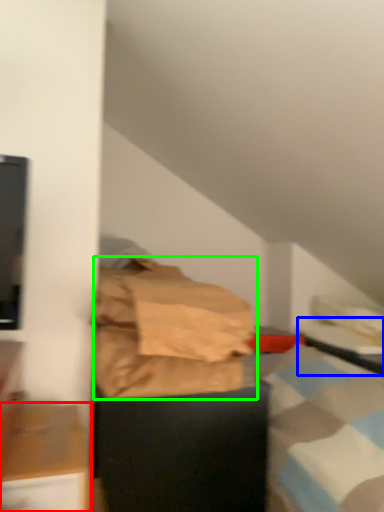
Question: Which object is positioned closest to furniture (highlighted by a red box)? Select from table (highlighted by a blue box) and material (highlighted by a green box).

Choices:
 (A) table
 (B) material

Answer: (B)